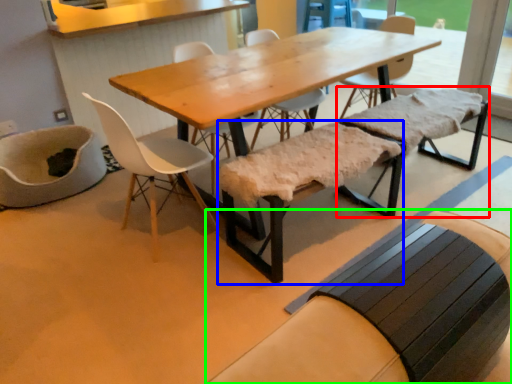
Question: Considering the real-world distances, which object is closest to church bench (highlighted by a red box)? church bench (highlighted by a blue box) or church bench (highlighted by a green box).

Choices:
 (A) church bench
 (B) church bench

Answer: (A)